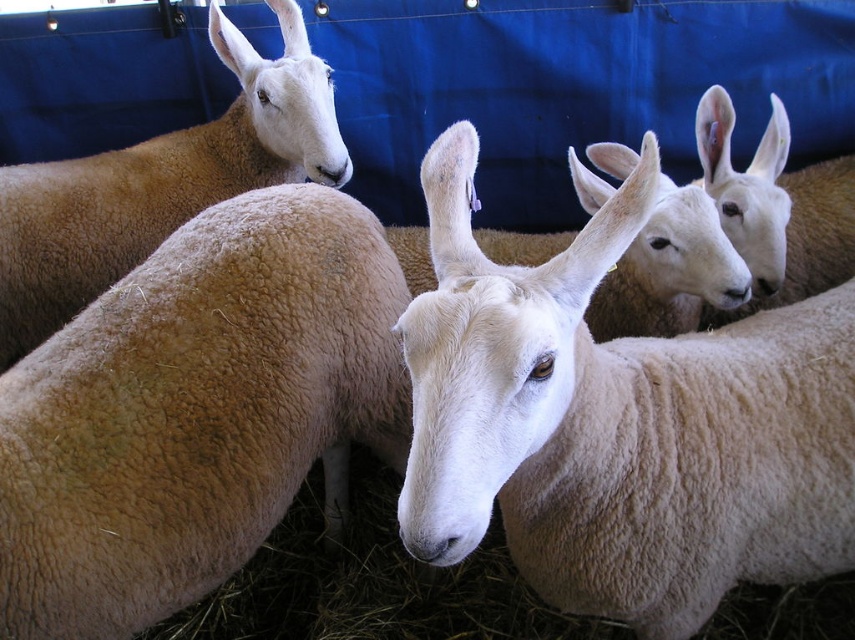
In the scene shown: Can you confirm if white woolen goat at center is positioned to the left of light brown woolly sheep at left?

Incorrect, white woolen goat at center is not on the left side of light brown woolly sheep at left.

Is white woolen goat at center bigger than light brown woolly sheep at left?

Yes.

Which is behind, point (755, 516) or point (181, 374)?

The point (181, 374) is behind.

Locate an element on the screen. white woolen goat at center is located at coordinates (x=618, y=424).

Which is more to the left, light brown woolly sheep at left or white woolen sheep at upper right?

light brown woolly sheep at left

Does point (54, 609) come behind point (732, 237)?

No, it is not.

Is point (84, 401) positioned in front of point (739, 246)?

Yes, it is.

The height and width of the screenshot is (640, 855). What are the coordinates of `light brown woolly sheep at left` in the screenshot? It's located at (195, 412).

Can you confirm if light brown woolly sheep at left is positioned to the left of light brown woolen sheep at left?

Incorrect, light brown woolly sheep at left is not on the left side of light brown woolen sheep at left.

Does light brown woolly sheep at left have a greater width compared to light brown woolen sheep at left?

No.

This screenshot has width=855, height=640. What are the coordinates of `light brown woolly sheep at left` in the screenshot? It's located at (195, 412).